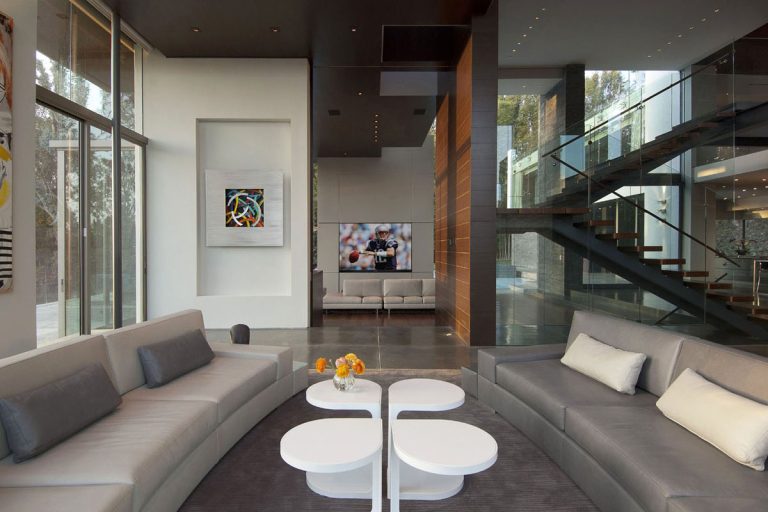
The height and width of the screenshot is (512, 768). I want to click on couch, so click(170, 426), click(593, 408), click(406, 298), click(341, 298).